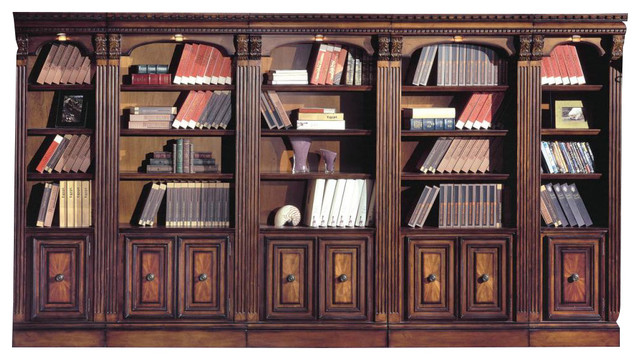
At what (x,y) coordinates should I click in order to perform the action: click on cabinets. Please return your answer as a coordinate pair (x, y). This screenshot has height=360, width=640. Looking at the image, I should click on (79, 284), (146, 282), (195, 279), (296, 277), (356, 277), (426, 274), (470, 271), (577, 281).